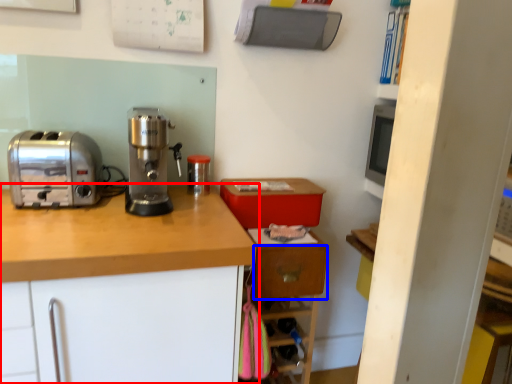
Question: Which of the following is the closest to the observer, cabinetry (highlighted by a red box) or drawer (highlighted by a blue box)?

Choices:
 (A) cabinetry
 (B) drawer

Answer: (A)